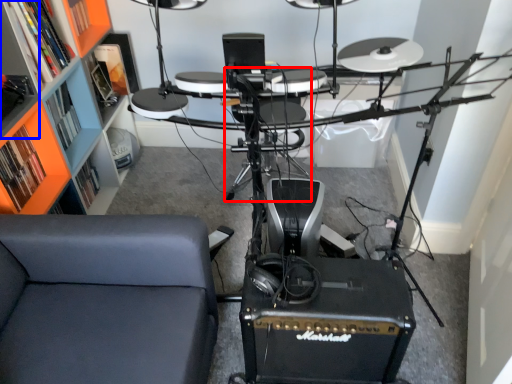
Question: Which object is further to the camera taking this photo, armchair (highlighted by a red box) or shelf (highlighted by a blue box)?

Choices:
 (A) armchair
 (B) shelf

Answer: (A)